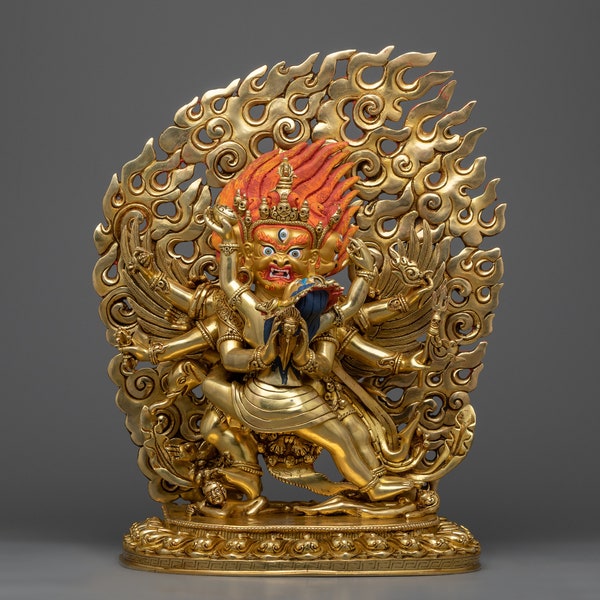
Locate an element on the screen. The image size is (600, 600). flat surface is located at coordinates (118, 576).